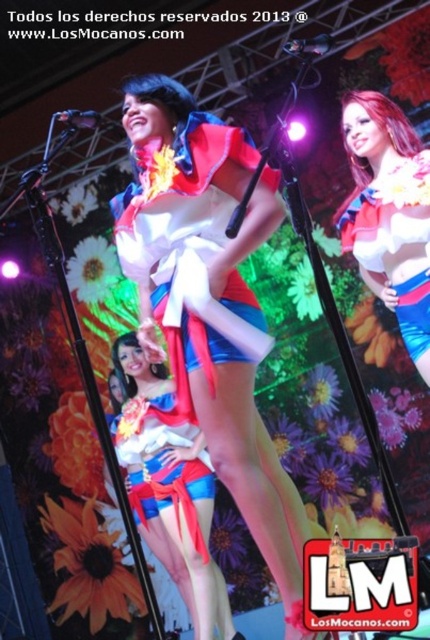
Question: Estimate the real-world distances between objects in this image. Which object is farther from the shiny satin dress at center?

Choices:
 (A) matte red fabric dress at center
 (B) black plastic microphone at upper center
 (C) matte red fabric skirt at center

Answer: (A)

Question: From the image, what is the correct spatial relationship of shiny satin skirt at center in relation to black plastic microphone at upper center?

Choices:
 (A) below
 (B) above

Answer: (A)

Question: In this image, where is shiny satin skirt at center located relative to matte red fabric skirt at center?

Choices:
 (A) right
 (B) left

Answer: (A)

Question: Among these objects, which one is farthest from the camera?

Choices:
 (A) shiny satin dress at center
 (B) black plastic microphone at upper center
 (C) matte red fabric skirt at center
 (D) metallic silver microphone at center

Answer: (C)

Question: Where is shiny satin costume at center located in relation to shiny satin dress at center in the image?

Choices:
 (A) above
 (B) below

Answer: (B)

Question: Which point is closer to the camera?

Choices:
 (A) (288, 516)
 (B) (171, 412)

Answer: (A)